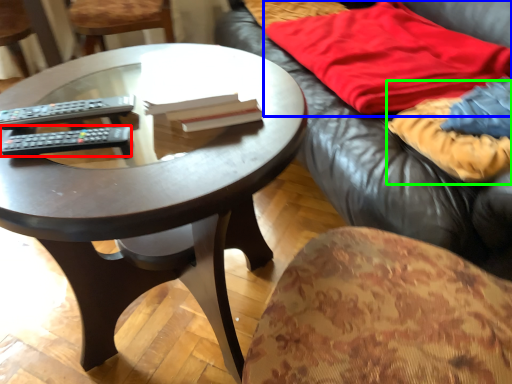
Question: Which is nearer to the remote control (highlighted by a red box)? blanket (highlighted by a blue box) or blanket (highlighted by a green box).

Choices:
 (A) blanket
 (B) blanket

Answer: (B)